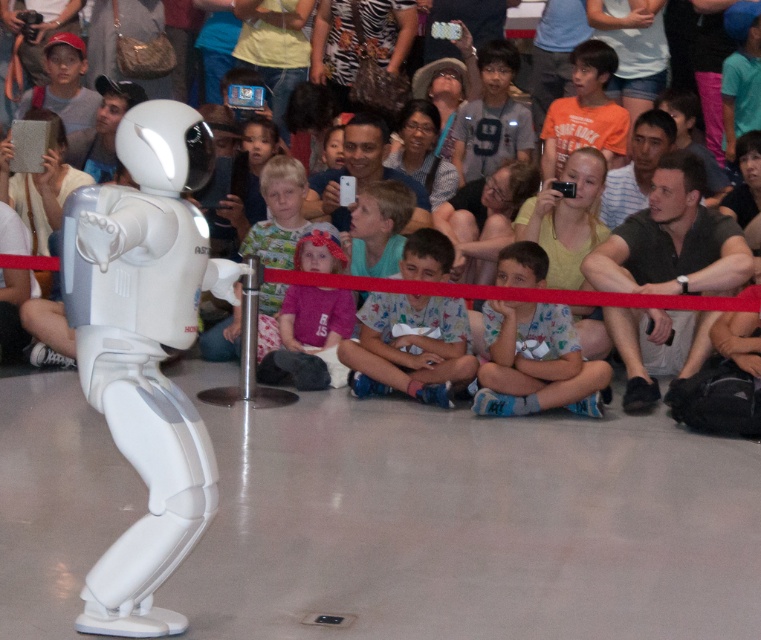
Can you confirm if gray matte shirt at center is smaller than white matte helmet at center?

Correct, gray matte shirt at center occupies less space than white matte helmet at center.

Is point (492, 128) farther from camera compared to point (126, 108)?

No, it is in front of (126, 108).

I want to click on gray matte shirt at center, so click(492, 116).

Does gray matte shirt at center appear on the left side of matte white phone at center?

No, gray matte shirt at center is not to the left of matte white phone at center.

How distant is gray matte shirt at center from matte white phone at center?

gray matte shirt at center is 3.68 feet away from matte white phone at center.

Image resolution: width=761 pixels, height=640 pixels. I want to click on gray matte shirt at center, so click(x=492, y=116).

Who is taller, zebra-patterned dress at center or matte black glasses at center?

Standing taller between the two is zebra-patterned dress at center.

Does point (400, 10) come farther from viewer compared to point (438, 170)?

That is True.

Where is `zebra-patterned dress at center`? This screenshot has width=761, height=640. zebra-patterned dress at center is located at coordinates (358, 42).